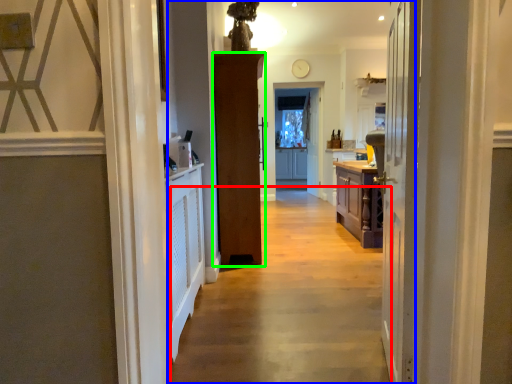
Question: Based on their relative distances, which object is farther from path (highlighted by a red box)? Choose from corridor (highlighted by a blue box) and door (highlighted by a green box).

Choices:
 (A) corridor
 (B) door

Answer: (A)